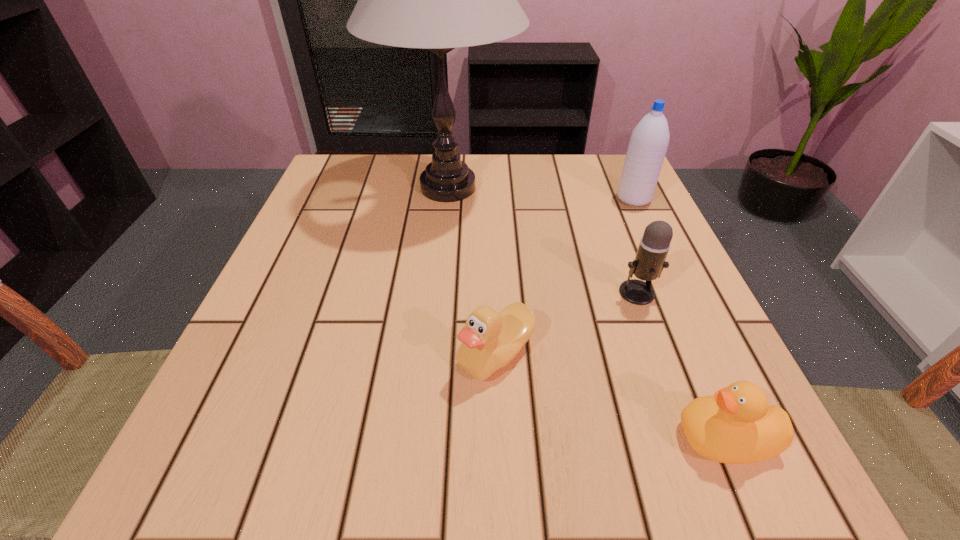
At what (x,y) coordinates should I click in order to perform the action: click on free region at the right edge. Please return your answer as a coordinate pair (x, y). The height and width of the screenshot is (540, 960). Looking at the image, I should click on pos(604,263).

In the image, there is a desktop. In order to click on vacant space at the far left corner in this screenshot , I will do `click(316, 203)`.

In the image, there is a desktop. Where is `free space at the far right corner`? This screenshot has height=540, width=960. free space at the far right corner is located at coordinates (630, 208).

The height and width of the screenshot is (540, 960). I want to click on vacant space in between the fourth shortest object and the nearer duck, so click(x=680, y=319).

The height and width of the screenshot is (540, 960). Identify the location of free space between the farther duck and the right duck. (611, 396).

Where is `free spot between the water bottle and the nearest object`? Image resolution: width=960 pixels, height=540 pixels. free spot between the water bottle and the nearest object is located at coordinates (680, 319).

Where is `vacant region between the right duck and the lamp`? vacant region between the right duck and the lamp is located at coordinates (587, 313).

Find the location of a particular element. free space between the second tallest object and the microphone is located at coordinates (636, 246).

Find the location of `free spot between the fourth shortest object and the fourth farthest object`. free spot between the fourth shortest object and the fourth farthest object is located at coordinates (564, 276).

Locate an element on the screen. blank region between the lamp and the farther duck is located at coordinates (472, 271).